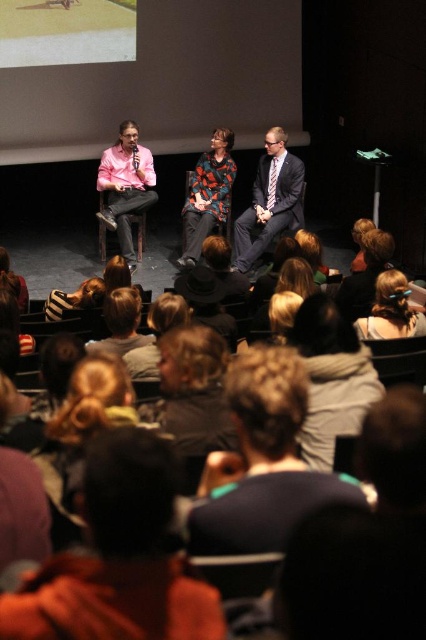
Between brown hair at lower center and matte gray suit at center, which one appears on the left side from the viewer's perspective?

Positioned to the left is brown hair at lower center.

Is point (94, 637) in front of point (245, 237)?

Yes, point (94, 637) is in front of point (245, 237).

In order to click on brown hair at lower center in this screenshot , I will do `click(118, 557)`.

Locate an element on the screen. The width and height of the screenshot is (426, 640). brown hair at lower center is located at coordinates (118, 557).

Does pink satin shirt at left appear over blonde hair at upper right?

Indeed, pink satin shirt at left is positioned over blonde hair at upper right.

Is pink satin shirt at left below blonde hair at upper right?

No, pink satin shirt at left is not below blonde hair at upper right.

Is point (129, 250) positioned before point (416, 317)?

No, (129, 250) is further to viewer.

I want to click on pink satin shirt at left, so point(126,186).

Can you confirm if blonde hair at center is shorter than matte gray suit at center?

Yes.

Which of these two, blonde hair at center or matte gray suit at center, stands shorter?

blonde hair at center

Does point (219, 547) come farther from viewer compared to point (261, 230)?

No, it is in front of (261, 230).

Image resolution: width=426 pixels, height=640 pixels. What are the coordinates of `blonde hair at center` in the screenshot? It's located at (264, 460).